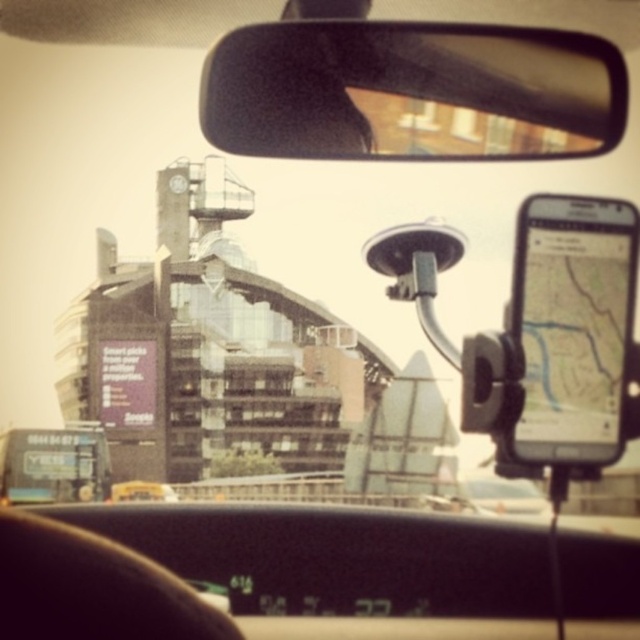
Between clear plastic mirror at upper center and black leather steering wheel at lower left, which one is positioned lower?

Positioned lower is black leather steering wheel at lower left.

Does point (433, 77) come closer to viewer compared to point (93, 532)?

Yes.

Identify the location of clear plastic mirror at upper center. (412, 92).

Is black leather steering wheel at lower left positioned behind metallic billboard at lower left?

No, it is in front of metallic billboard at lower left.

Can you confirm if black leather steering wheel at lower left is shorter than metallic billboard at lower left?

Incorrect, black leather steering wheel at lower left's height does not fall short of metallic billboard at lower left's.

Identify the location of black leather steering wheel at lower left. (92, 588).

Can you confirm if clear plastic mirror at upper center is smaller than metallic billboard at lower left?

Actually, clear plastic mirror at upper center might be larger than metallic billboard at lower left.

Is clear plastic mirror at upper center positioned behind metallic billboard at lower left?

No, it is not.

Is point (209, 58) less distant than point (81, 429)?

Yes, point (209, 58) is closer to viewer.

Identify the location of clear plastic mirror at upper center. (412, 92).